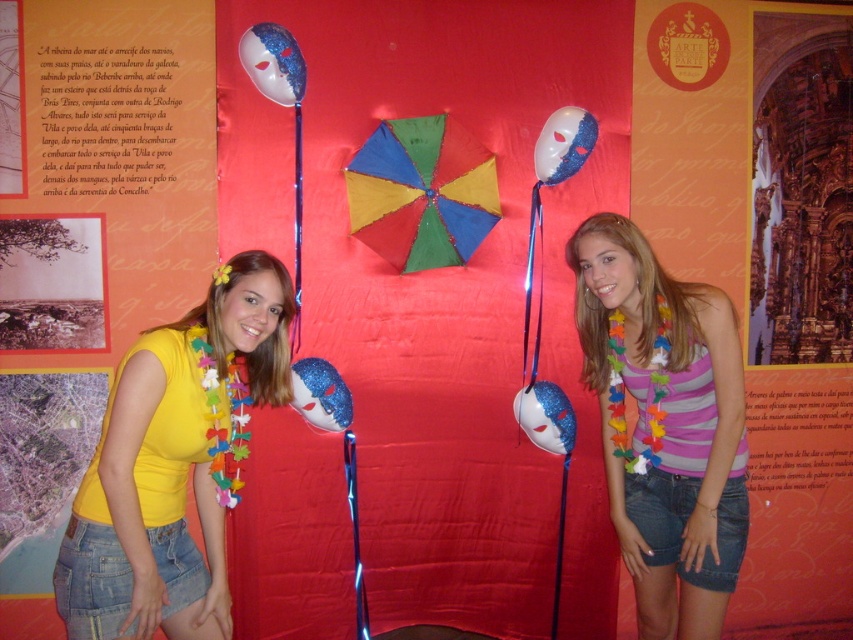
You are a photographer setting up a shoot in front of this backdrop. You need to ensure that the striped jersey at center and the glittery white mask at upper center are both visible in the frame. Given their sizes, which object might require you to adjust your camera angle to include it fully?

The striped jersey at center has a greater height compared to the glittery white mask at upper center, so it might require adjusting the camera angle to ensure it is fully visible in the frame.

You are standing in front of the backdrop and want to place a new decorative item between the two people. The item must be placed exactly at the midpoint between the two people. Given the coordinates of the striped jersey at center, which is point (665, 426), can you determine if this point is the correct midpoint between the two individuals?

The striped jersey at center is represented by point (665, 426), so this point is the midpoint between the two individuals.